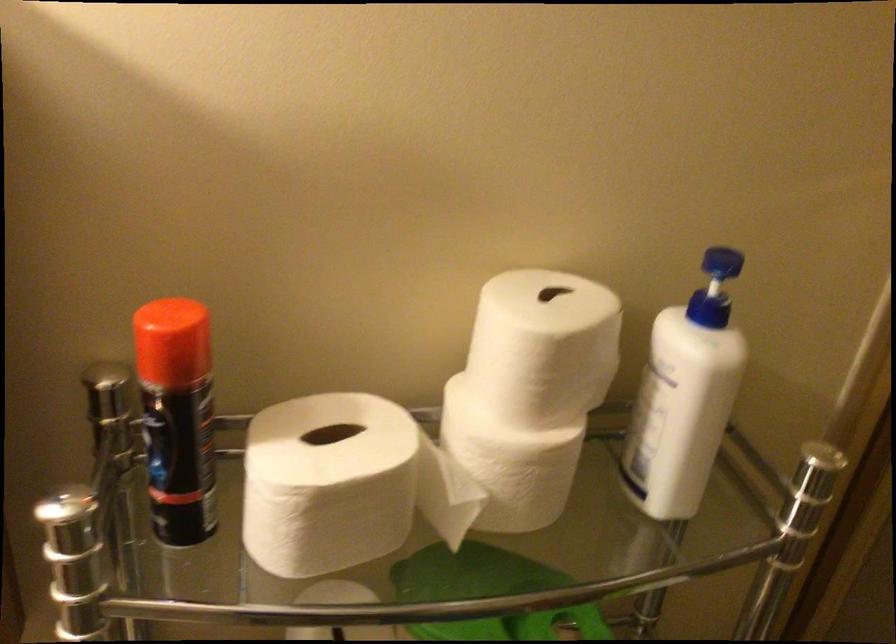
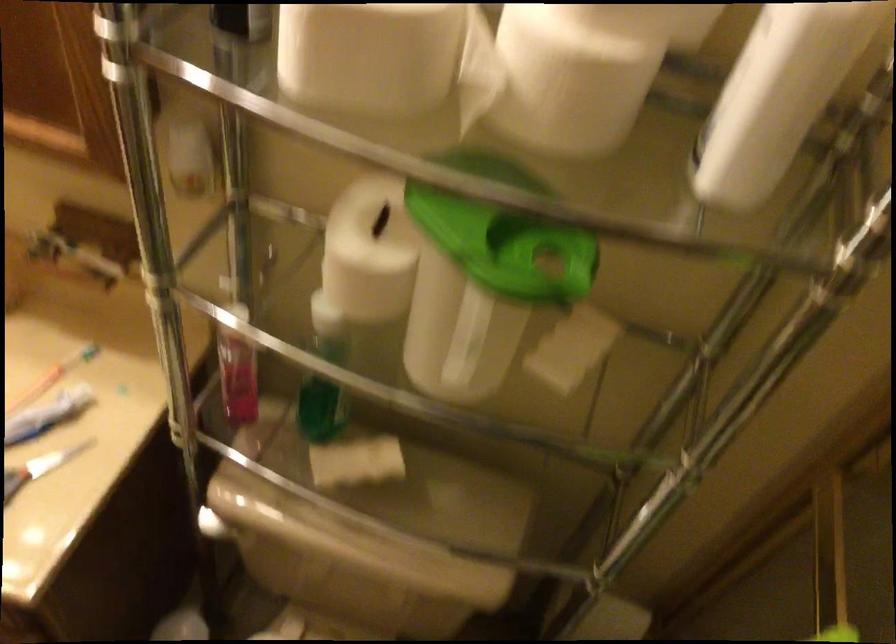
Find the pixel in the second image that matches (703,428) in the first image.

(778, 96)